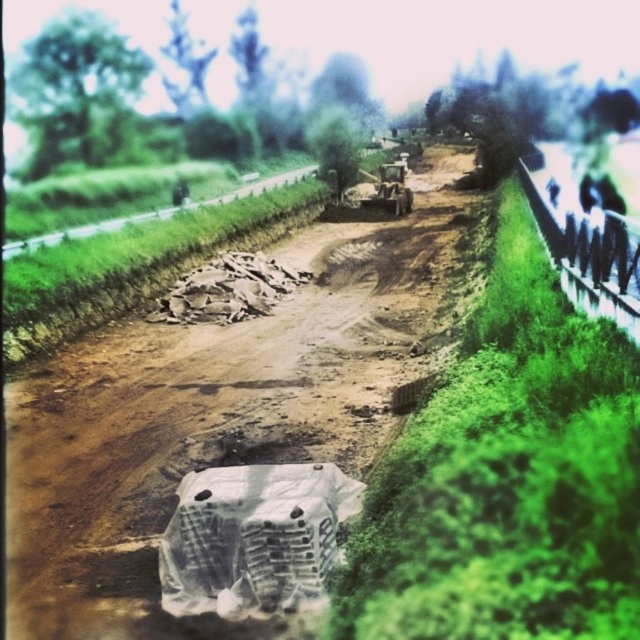
You are a construction worker standing at the point labeled as point (214,413) in the image. What is the immediate terrain you are standing on?

The point (214,413) indicates brown sandy dirt track at center, so you are standing on the brown sandy dirt track at center.

You are a surveyor standing at point A and need to reach point B. The coordinates for point A are (20, 248), and point B are (417, 232). According to the scene, which direction should you move to get from point A to point B?

You should move towards the upper direction because point B is behind point A, so moving upwards from point A will lead you to point B.